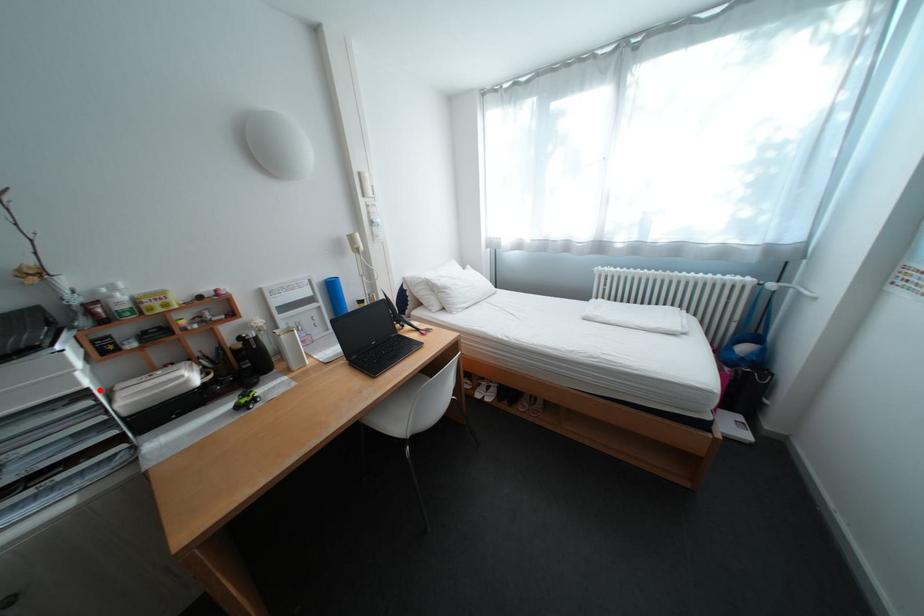
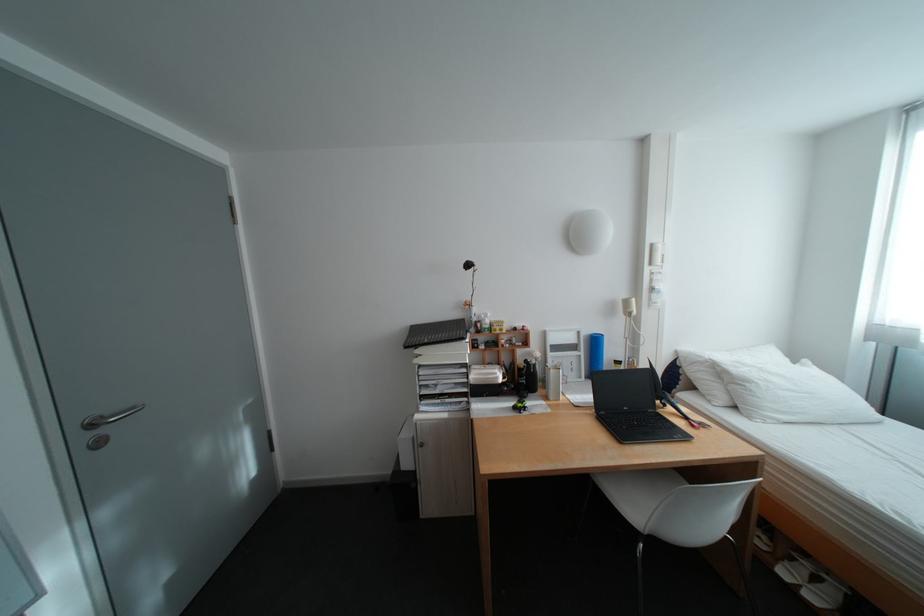
In the second image, find the point that corresponds to the highlighted location in the first image.

(480, 363)